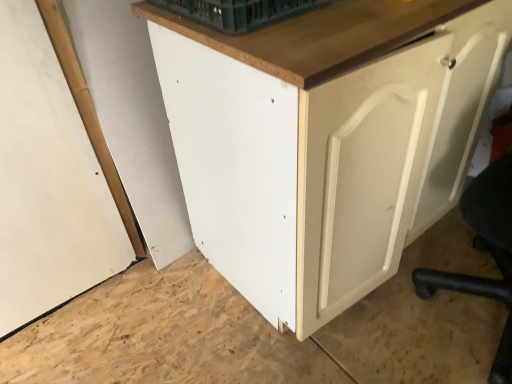
Question: Would you say green plastic basket at upper center contains matte white cabinet at center?

Choices:
 (A) yes
 (B) no

Answer: (B)

Question: Does green plastic basket at upper center have a smaller size compared to matte white cabinet at center?

Choices:
 (A) no
 (B) yes

Answer: (B)

Question: Is green plastic basket at upper center aimed at matte white cabinet at center?

Choices:
 (A) yes
 (B) no

Answer: (B)

Question: Is green plastic basket at upper center at the right side of matte white cabinet at center?

Choices:
 (A) yes
 (B) no

Answer: (B)

Question: Can you see green plastic basket at upper center touching matte white cabinet at center?

Choices:
 (A) no
 (B) yes

Answer: (A)

Question: Which is correct: white matte door at right is inside matte white cabinet at center, or outside of it?

Choices:
 (A) outside
 (B) inside

Answer: (A)

Question: In the image, is white matte door at right on the left side or the right side of matte white cabinet at center?

Choices:
 (A) left
 (B) right

Answer: (B)

Question: Does point (440, 162) appear closer or farther from the camera than point (313, 196)?

Choices:
 (A) farther
 (B) closer

Answer: (A)

Question: Considering the positions of white matte door at right and matte white cabinet at center in the image, is white matte door at right bigger or smaller than matte white cabinet at center?

Choices:
 (A) small
 (B) big

Answer: (A)

Question: Visually, is green plastic basket at upper center positioned to the left or to the right of white matte door at right?

Choices:
 (A) left
 (B) right

Answer: (A)

Question: Is green plastic basket at upper center spatially inside white matte door at right, or outside of it?

Choices:
 (A) inside
 (B) outside

Answer: (B)

Question: In terms of height, does green plastic basket at upper center look taller or shorter compared to white matte door at right?

Choices:
 (A) tall
 (B) short

Answer: (B)

Question: Is green plastic basket at upper center bigger or smaller than white matte door at right?

Choices:
 (A) big
 (B) small

Answer: (B)

Question: Do you think matte white cabinet at center is within white matte door at right, or outside of it?

Choices:
 (A) inside
 (B) outside

Answer: (B)

Question: Looking at their shapes, would you say matte white cabinet at center is wider or thinner than white matte door at right?

Choices:
 (A) thin
 (B) wide

Answer: (B)